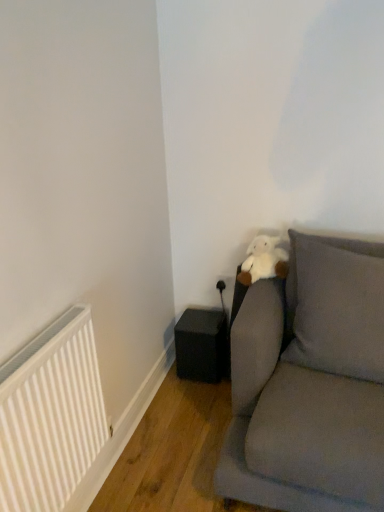
Where is `vacant area on top of white matte radiator at lower left (from a real-world perspective)`? The image size is (384, 512). vacant area on top of white matte radiator at lower left (from a real-world perspective) is located at coordinates (41, 324).